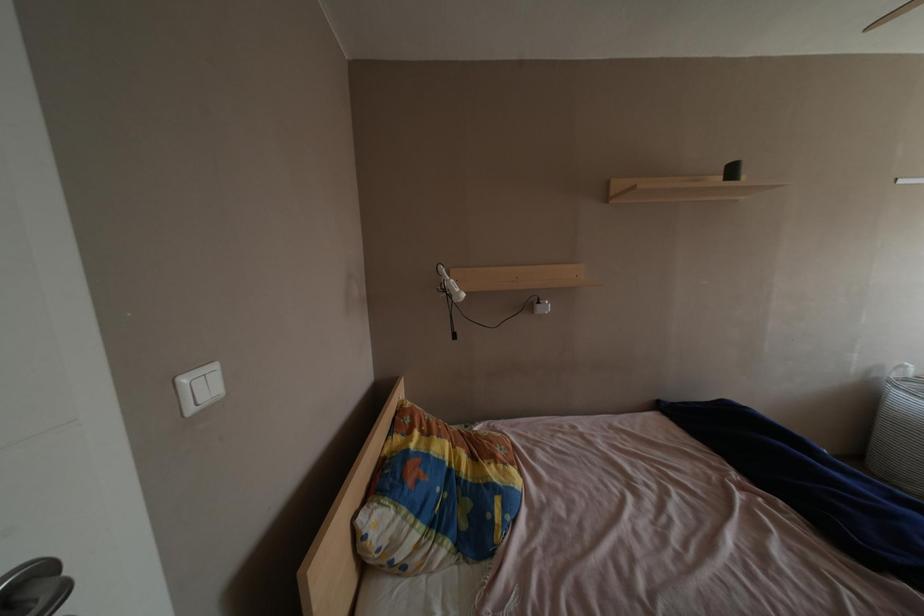
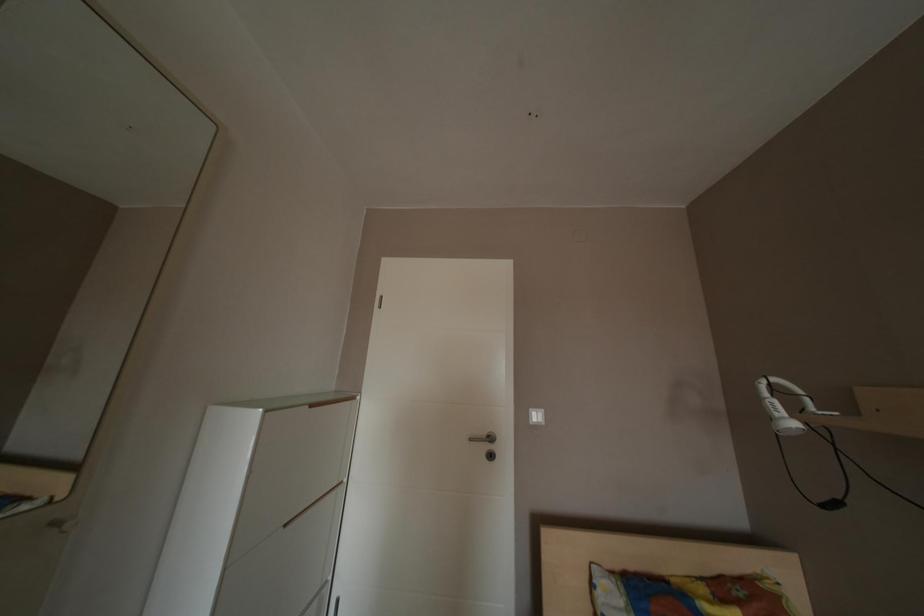
Question: Based on the continuous images, in which direction is the camera rotating? Reply with the corresponding letter.

Choices:
 (A) Left
 (B) Right
 (C) Up
 (D) Down

Answer: (A)